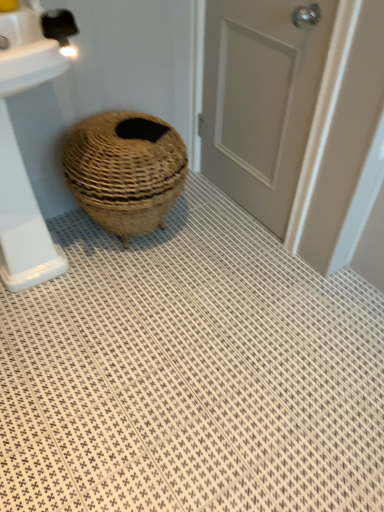
I want to click on free space to the right of natural woven basket at center, so click(217, 245).